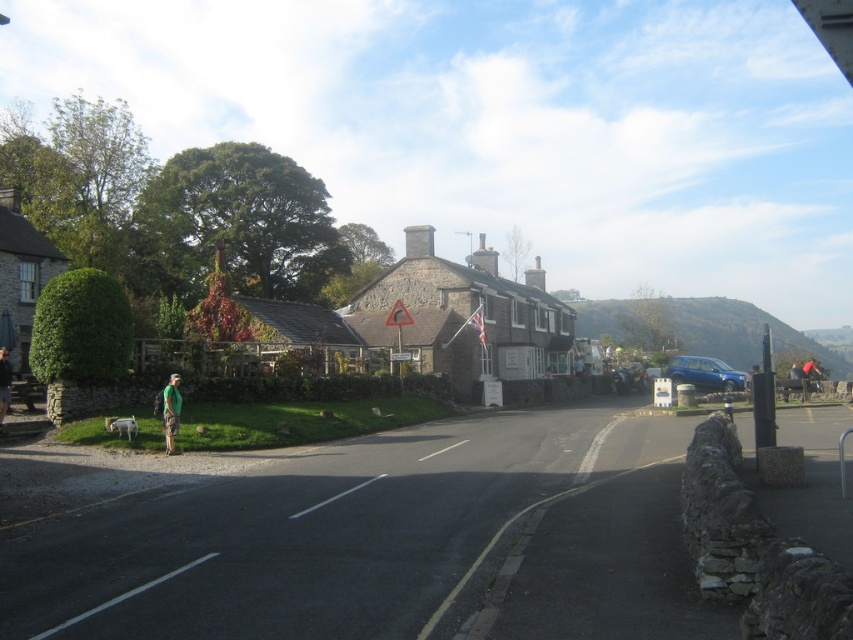
Question: Estimate the real-world distances between objects in this image. Which object is farther from the stone house at center?

Choices:
 (A) green fabric shirt at lower left
 (B) green fabric backpack at lower left

Answer: (A)

Question: Estimate the real-world distances between objects in this image. Which object is farther from the stone house at center?

Choices:
 (A) green fabric shirt at lower left
 (B) green fabric backpack at lower left

Answer: (A)

Question: Considering the relative positions of stone house at center and green fabric shirt at lower left in the image provided, where is stone house at center located with respect to green fabric shirt at lower left?

Choices:
 (A) above
 (B) below

Answer: (A)

Question: Can you confirm if green fabric backpack at lower left is smaller than green fabric shirt at lower left?

Choices:
 (A) yes
 (B) no

Answer: (A)

Question: Which object is the closest to the stone house at center?

Choices:
 (A) green fabric shirt at lower left
 (B) green fabric backpack at lower left

Answer: (B)

Question: Does stone house at center have a greater width compared to green fabric backpack at lower left?

Choices:
 (A) no
 (B) yes

Answer: (B)